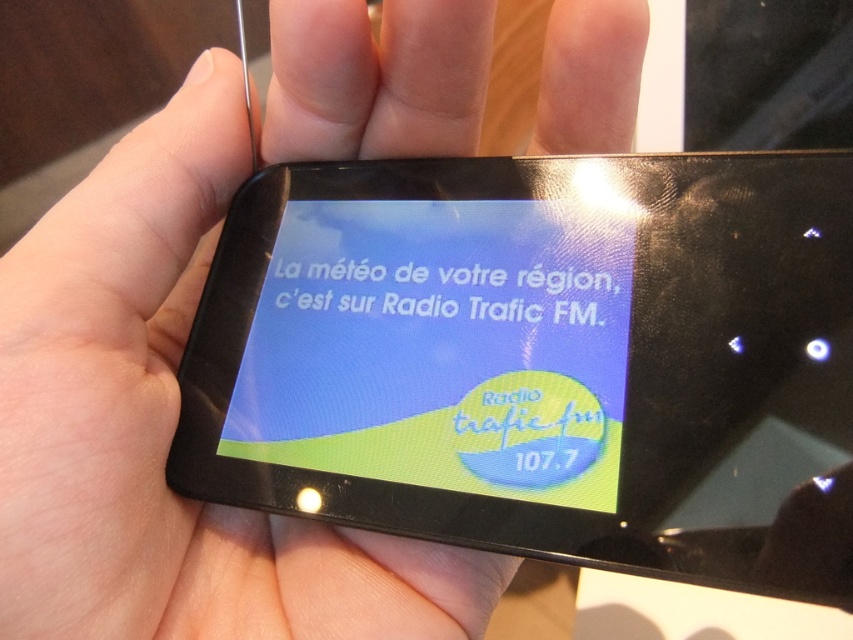
You are holding a smartphone and want to check the weather forecast. The screen shows a message about Radio Trafic FM at 107.7. If your eyes are 29 inches away from the screen, can you comfortably read the text on the point at coordinates point (277, 204)?

The distance of point (277, 204) from viewer is 29.13 inches. Since your eyes are 29 inches away from the screen, you can comfortably read the text on the point at coordinates point (277, 204).